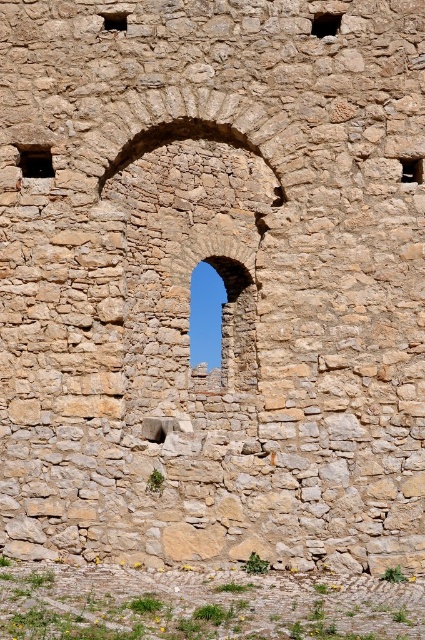
You are standing in front of the stone wall with the matte stone window at upper right. If you want to take a photo of the window, where should you position yourself relative to the wall?

To take a photo of the matte stone window at upper right, you should position yourself near the upper right area of the wall since the window is located at point (411, 170).

You are an architect designing a restoration plan for this stone wall. You need to ensure that all windows align properly. Given the stone window at upper center and the matte stone window at upper left, which one has a greater width?

The stone window at upper center has a greater width than the matte stone window at upper left according to the description.

You are an architect examining the stone wall and notice two windows, the brown stone window at upper left and the matte stone window at upper left. Which one is located more to the left side?

The brown stone window at upper left is positioned on the left side of matte stone window at upper left, so it is more to the left.